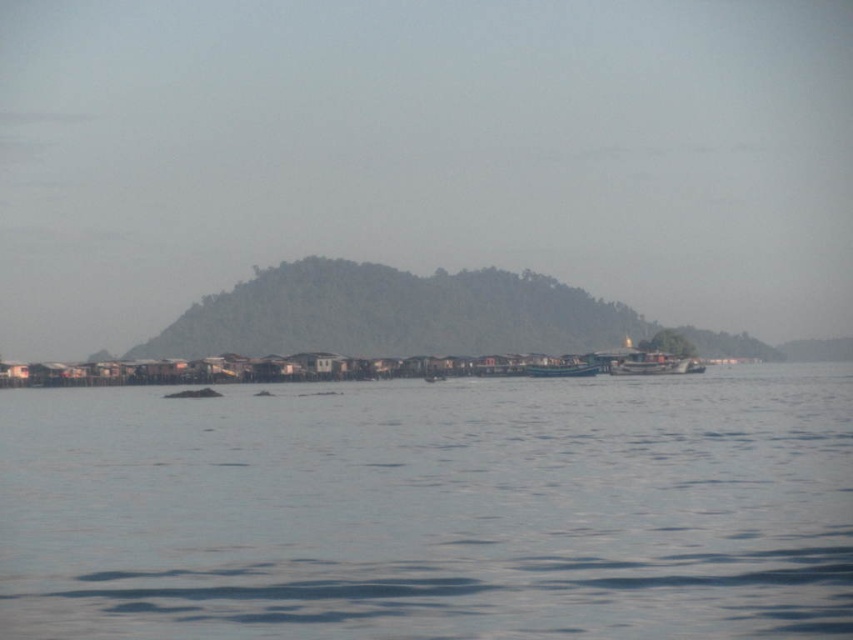
Does metallic silver boat at center have a greater width compared to wooden boat at center?

No.

Does metallic silver boat at center appear on the right side of wooden boat at center?

Yes, metallic silver boat at center is to the right of wooden boat at center.

What do you see at coordinates (653, 364) in the screenshot? This screenshot has height=640, width=853. I see `metallic silver boat at center` at bounding box center [653, 364].

Identify the location of metallic silver boat at center. click(653, 364).

Is point (196, 547) positioned in front of point (563, 365)?

Yes, point (196, 547) is in front of point (563, 365).

Is point (3, 476) positioned after point (531, 369)?

No, it is not.

What are the coordinates of `clear blue water at center` in the screenshot? It's located at (433, 509).

Find the location of a particular element. clear blue water at center is located at coordinates (433, 509).

Who is lower down, clear blue water at center or metallic silver boat at center?

clear blue water at center is below.

Does clear blue water at center have a lesser height compared to metallic silver boat at center?

No.

Is point (53, 634) positioned after point (663, 355)?

No.

Locate an element on the screen. The height and width of the screenshot is (640, 853). clear blue water at center is located at coordinates (433, 509).